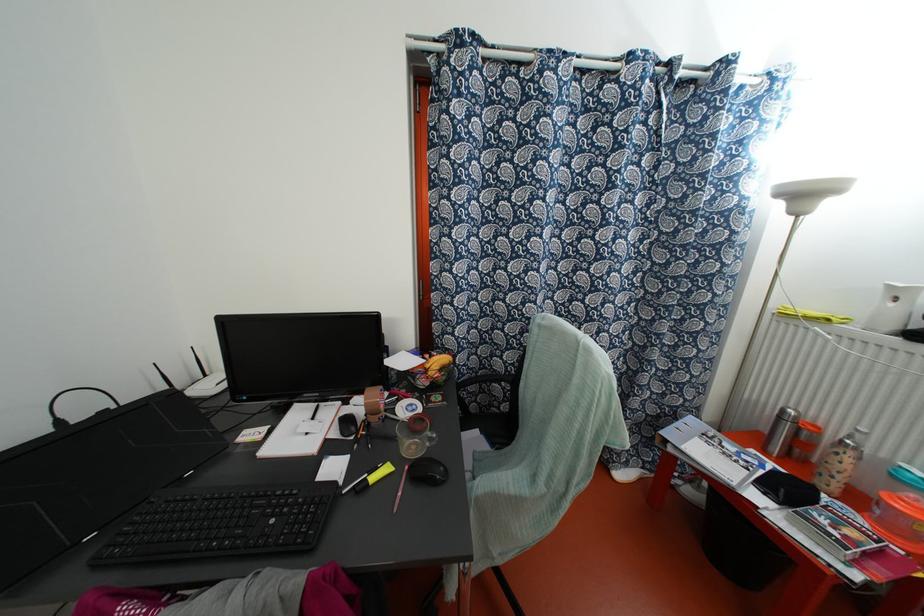
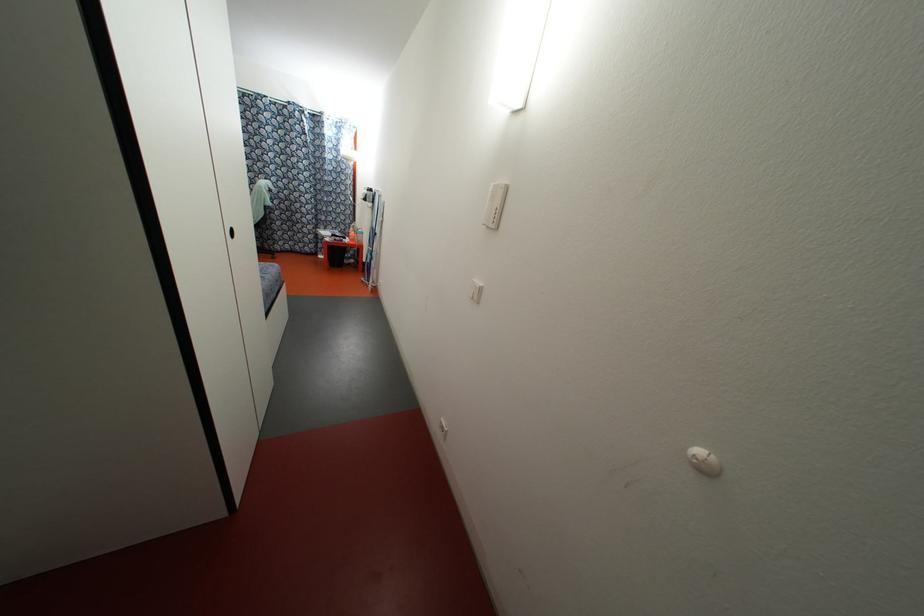
The images are taken continuously from a first-person perspective. In which direction are you moving?

The movement direction of the cameraman is right, backward.